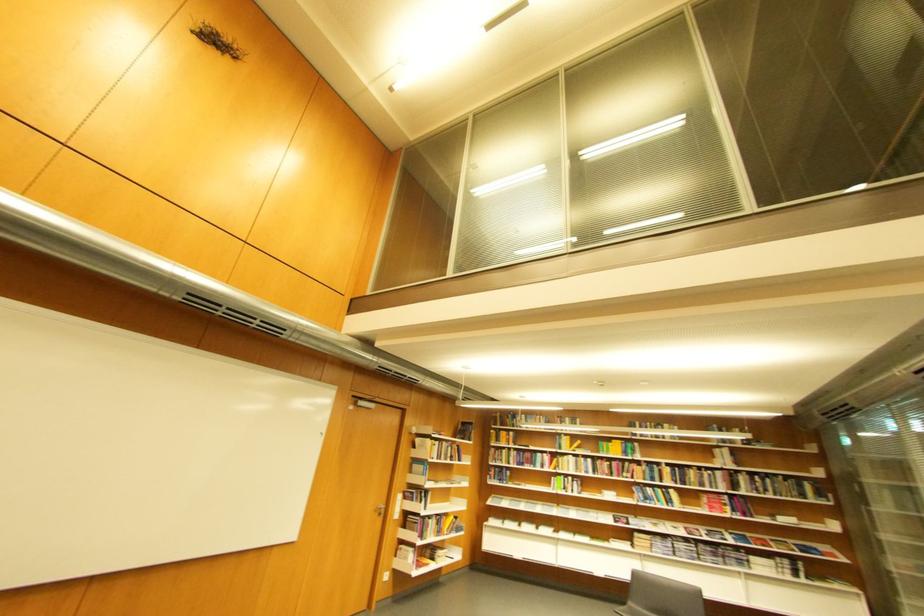
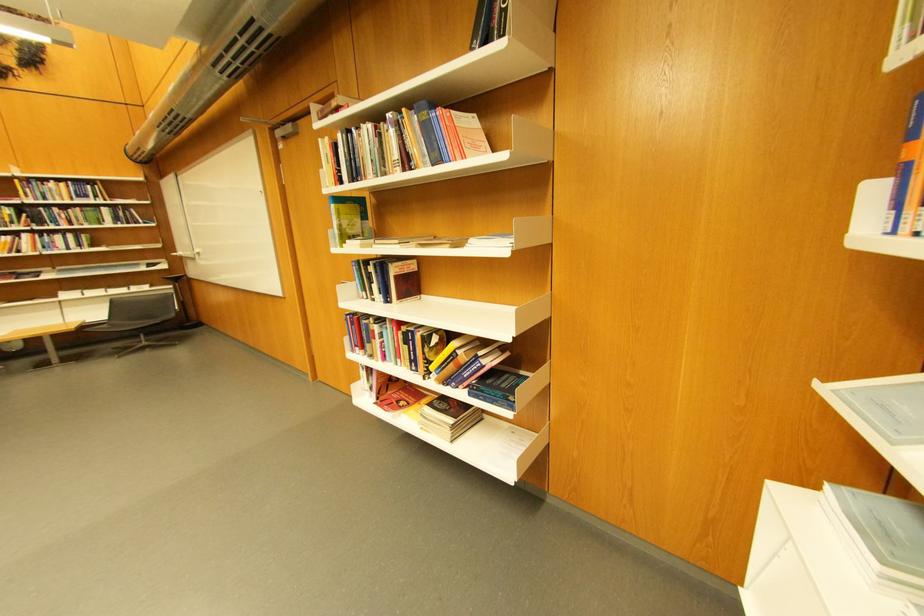
Locate, in the second image, the point that corresponds to point 453,446 in the first image.

(370, 137)